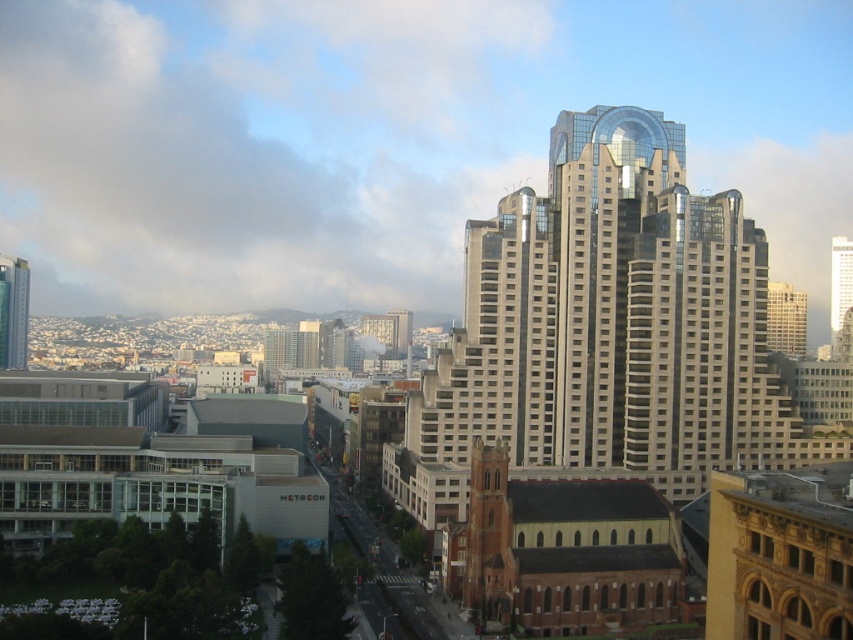
Question: Can you confirm if glassy metallic skyscraper at center is wider than matte silver skyscraper at left?

Choices:
 (A) yes
 (B) no

Answer: (A)

Question: Estimate the real-world distances between objects in this image. Which object is farther from the glassy metallic skyscraper at center?

Choices:
 (A) matte silver skyscraper at left
 (B) glassy skyscraper at center

Answer: (A)

Question: Which point is closer to the camera?

Choices:
 (A) glassy skyscraper at center
 (B) matte silver skyscraper at left
 (C) glassy metallic skyscraper at center

Answer: (C)

Question: Can you confirm if glassy metallic skyscraper at center is thinner than glassy skyscraper at center?

Choices:
 (A) yes
 (B) no

Answer: (A)

Question: Which of these objects is positioned farthest from the glassy metallic skyscraper at center?

Choices:
 (A) glassy skyscraper at center
 (B) matte silver skyscraper at left

Answer: (B)

Question: Is matte silver skyscraper at left thinner than glassy skyscraper at center?

Choices:
 (A) yes
 (B) no

Answer: (A)